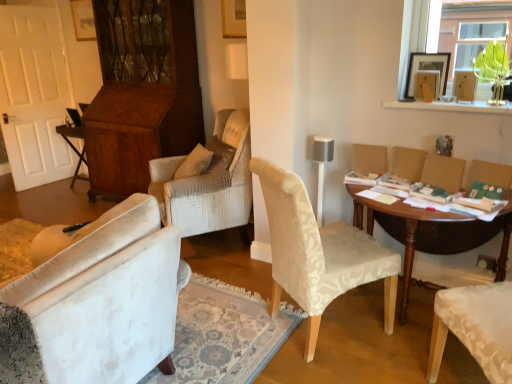
What do you see at coordinates (318, 253) in the screenshot? The width and height of the screenshot is (512, 384). I see `light beige fabric chair at center` at bounding box center [318, 253].

Find the location of a particular element. teal fabric armchair at right, which appears as the 1th armchair when viewed from the right is located at coordinates pos(489,174).

Image resolution: width=512 pixels, height=384 pixels. In order to click on wooden table at center, which is the second table in back-to-front order in this screenshot , I will do `click(432, 235)`.

Considering the sizes of objects matte beige armchair at right, placed as the 1th armchair when sorted from left to right, and wooden table at center, acting as the 2th table starting from the top, in the image provided, who is bigger, matte beige armchair at right, placed as the 1th armchair when sorted from left to right, or wooden table at center, acting as the 2th table starting from the top,?

wooden table at center, acting as the 2th table starting from the top.

Which object is closer to the camera taking this photo, matte beige armchair at right, placed as the 1th armchair when sorted from left to right, or wooden table at center, acting as the 2th table starting from the top?

wooden table at center, acting as the 2th table starting from the top.

From the image's perspective, would you say matte beige armchair at right, marked as the 3th armchair in a right-to-left arrangement, is positioned over wooden table at center, the 2th table positioned from the left?

Yes.

Which is farther, [408,150] or [436,245]?

The point [436,245] is more distant.

Which object is thinner, light beige fabric chair at center or matte beige armchair at right, which is the 2th armchair in left-to-right order?

matte beige armchair at right, which is the 2th armchair in left-to-right order, is thinner.

From a real-world perspective, is light beige fabric chair at center on top of matte beige armchair at right, which is the 2th armchair in left-to-right order?

No, from a real-world perspective, light beige fabric chair at center is not over matte beige armchair at right, which is the 2th armchair in left-to-right order

Considering the relative sizes of light beige fabric chair at center and matte beige armchair at right, which is the 2th armchair in left-to-right order, in the image provided, is light beige fabric chair at center bigger than matte beige armchair at right, which is the 2th armchair in left-to-right order,?

Correct, light beige fabric chair at center is larger in size than matte beige armchair at right, which is the 2th armchair in left-to-right order.

Would you say light beige fabric chair at center contains matte beige armchair at right, which is counted as the second armchair, starting from the right?

No, matte beige armchair at right, which is counted as the second armchair, starting from the right, is not a part of light beige fabric chair at center.

What's the angular difference between matte beige armchair at right, which is the 2th armchair in left-to-right order, and wooden folding table at left, placed as the second table when sorted from right to left,'s facing directions?

They differ by 14.8 degrees in their facing directions.

Would you say matte beige armchair at right, which is counted as the second armchair, starting from the right, is a long distance from wooden folding table at left, placed as the second table when sorted from right to left?

Yes, matte beige armchair at right, which is counted as the second armchair, starting from the right, and wooden folding table at left, placed as the second table when sorted from right to left, are located far from each other.

Does matte beige armchair at right, which is the 2th armchair in left-to-right order, have a greater height compared to wooden folding table at left, placed as the second table when sorted from right to left?

No.

From a real-world perspective, between matte beige armchair at right, which is the 2th armchair in left-to-right order, and wooden folding table at left, which appears as the 1th table when viewed from the back, who is vertically higher?

From a 3D spatial view, matte beige armchair at right, which is the 2th armchair in left-to-right order, is above.

Is point (507, 31) closer or farther from the camera than point (270, 211)?

Point (507, 31).

Between transparent glass vase at upper right and light beige fabric chair at center, which one has smaller width?

Thinner between the two is transparent glass vase at upper right.

Is transparent glass vase at upper right far from light beige fabric chair at center?

Yes, transparent glass vase at upper right is far from light beige fabric chair at center.

How many degrees apart are the facing directions of transparent glass vase at upper right and light beige fabric chair at center?

They differ by 155 degrees in their facing directions.

Does teal fabric armchair at right, which appears as the 1th armchair when viewed from the right, have a lesser width compared to wooden picture frame at upper right?

No.

Is teal fabric armchair at right, which appears as the 1th armchair when viewed from the right, turned away from wooden picture frame at upper right?

No, teal fabric armchair at right, which appears as the 1th armchair when viewed from the right,'s orientation is not away from wooden picture frame at upper right.

Is teal fabric armchair at right, which appears as the 1th armchair when viewed from the right, located outside wooden picture frame at upper right?

Yes, teal fabric armchair at right, which appears as the 1th armchair when viewed from the right, is located beyond the bounds of wooden picture frame at upper right.

In the scene shown: From the image's perspective, would you say teal fabric armchair at right, which appears as the 1th armchair when viewed from the right, is positioned over wooden picture frame at upper right?

No.

Can you confirm if wooden picture frame at upper right is taller than wooden table at center, the 2th table positioned from the left?

Incorrect, the height of wooden picture frame at upper right is not larger of that of wooden table at center, the 2th table positioned from the left.

Who is bigger, wooden picture frame at upper right or wooden table at center, acting as the 2th table starting from the top?

Bigger between the two is wooden table at center, acting as the 2th table starting from the top.

Is wooden picture frame at upper right turned away from wooden table at center, which ranks as the 1th table in bottom-to-top order?

That's not correct — wooden picture frame at upper right is not looking away from wooden table at center, which ranks as the 1th table in bottom-to-top order.

From the image's perspective, between wooden picture frame at upper right and wooden table at center, which ranks as the 1th table in bottom-to-top order, which one is located above?

wooden picture frame at upper right.

Does matte beige armchair at right, placed as the 1th armchair when sorted from left to right, turn towards transparent glass vase at upper right?

No, matte beige armchair at right, placed as the 1th armchair when sorted from left to right, is not turned towards transparent glass vase at upper right.

Is matte beige armchair at right, placed as the 1th armchair when sorted from left to right, positioned in front of transparent glass vase at upper right?

No, matte beige armchair at right, placed as the 1th armchair when sorted from left to right, is further to the viewer.

Which is correct: matte beige armchair at right, placed as the 1th armchair when sorted from left to right, is inside transparent glass vase at upper right, or outside of it?

matte beige armchair at right, placed as the 1th armchair when sorted from left to right, is not inside transparent glass vase at upper right, it's outside.

From the image's perspective, which armchair is the 3rd one above the wooden table at center, which is counted as the first table, starting from the right? Please provide its 2D coordinates.

[(408, 163)]

Starting from the light beige fabric chair at center, which armchair is the 2nd one behind? Please provide its 2D coordinates.

[(443, 172)]

Estimate the real-world distances between objects in this image. Which object is further from wooden table at center, the first table from the front, matte beige armchair at right, marked as the 3th armchair in a right-to-left arrangement, or light beige fabric chair at center?

light beige fabric chair at center is further to wooden table at center, the first table from the front.

Considering their positions, is matte beige armchair at right, which is counted as the second armchair, starting from the right, positioned further to matte beige armchair at right, marked as the 3th armchair in a right-to-left arrangement, than teal fabric armchair at right, which appears as the 1th armchair when viewed from the right?

The object further to matte beige armchair at right, marked as the 3th armchair in a right-to-left arrangement, is teal fabric armchair at right, which appears as the 1th armchair when viewed from the right.

Looking at the image, which one is located further to teal fabric armchair at right, placed as the 3th armchair when sorted from left to right, wooden table at center, which ranks as the 1th table in bottom-to-top order, or matte beige armchair at right, which is the 2th armchair in left-to-right order?

The object further to teal fabric armchair at right, placed as the 3th armchair when sorted from left to right, is wooden table at center, which ranks as the 1th table in bottom-to-top order.

Which object lies further to the anchor point teal fabric armchair at right, which appears as the 1th armchair when viewed from the right, matte beige armchair at right, placed as the 1th armchair when sorted from left to right, or wooden picture frame at upper right?

Among the two, wooden picture frame at upper right is located further to teal fabric armchair at right, which appears as the 1th armchair when viewed from the right.

Looking at the image, which one is located further to wooden folding table at left, the second table when ordered from bottom to top, matte beige armchair at right, placed as the 1th armchair when sorted from left to right, or light beige fabric chair at center?

The object further to wooden folding table at left, the second table when ordered from bottom to top, is matte beige armchair at right, placed as the 1th armchair when sorted from left to right.

Looking at the image, which one is located closer to matte beige armchair at right, placed as the 1th armchair when sorted from left to right, teal fabric armchair at right, placed as the 3th armchair when sorted from left to right, or wooden picture frame at upper right?

Based on the image, teal fabric armchair at right, placed as the 3th armchair when sorted from left to right, appears to be nearer to matte beige armchair at right, placed as the 1th armchair when sorted from left to right.

When comparing their distances from wooden picture frame at upper right, does wooden folding table at left, positioned as the second table in front-to-back order, or matte beige armchair at right, marked as the 3th armchair in a right-to-left arrangement, seem further?

Based on the image, wooden folding table at left, positioned as the second table in front-to-back order, appears to be further to wooden picture frame at upper right.

When comparing their distances from wooden folding table at left, placed as the second table when sorted from right to left, does light beige fabric chair at center or wooden picture frame at upper right seem closer?

light beige fabric chair at center is positioned closer to the anchor wooden folding table at left, placed as the second table when sorted from right to left.

Locate an element on the screen. The width and height of the screenshot is (512, 384). chair between wooden folding table at left, the 1th table positioned from the left, and matte beige armchair at right, which is the 2th armchair in left-to-right order, in the horizontal direction is located at coordinates (318, 253).

This screenshot has height=384, width=512. Identify the location of armchair that lies between wooden picture frame at upper right and matte beige armchair at right, which is counted as the second armchair, starting from the right, from top to bottom. (408, 163).

The image size is (512, 384). Identify the location of armchair located between teal fabric armchair at right, which appears as the 1th armchair when viewed from the right, and matte beige armchair at right, marked as the 3th armchair in a right-to-left arrangement, in the depth direction. (443, 172).

Where is `table between light beige fabric chair at center and wooden folding table at left, which appears as the 1th table when viewed from the back, along the z-axis`? table between light beige fabric chair at center and wooden folding table at left, which appears as the 1th table when viewed from the back, along the z-axis is located at coordinates (432, 235).